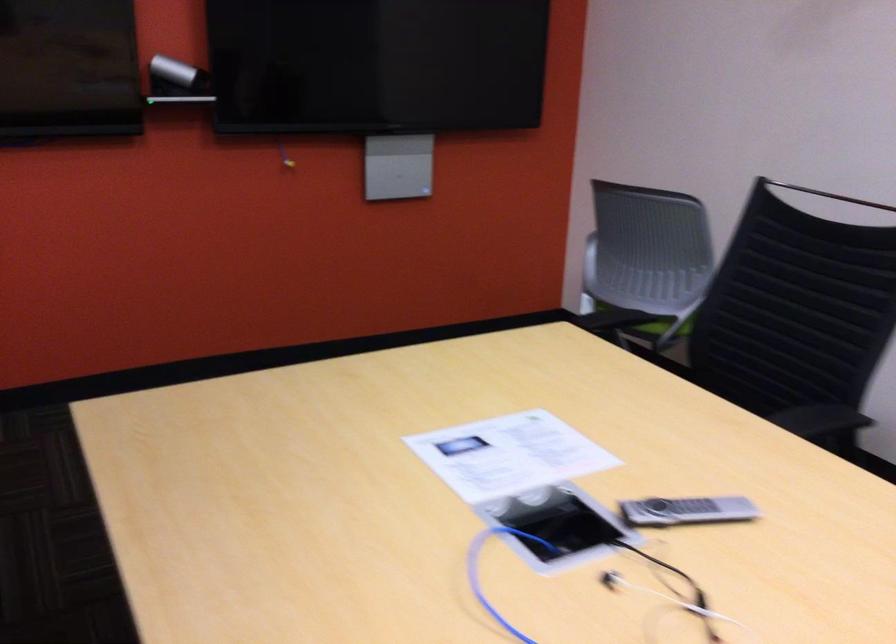
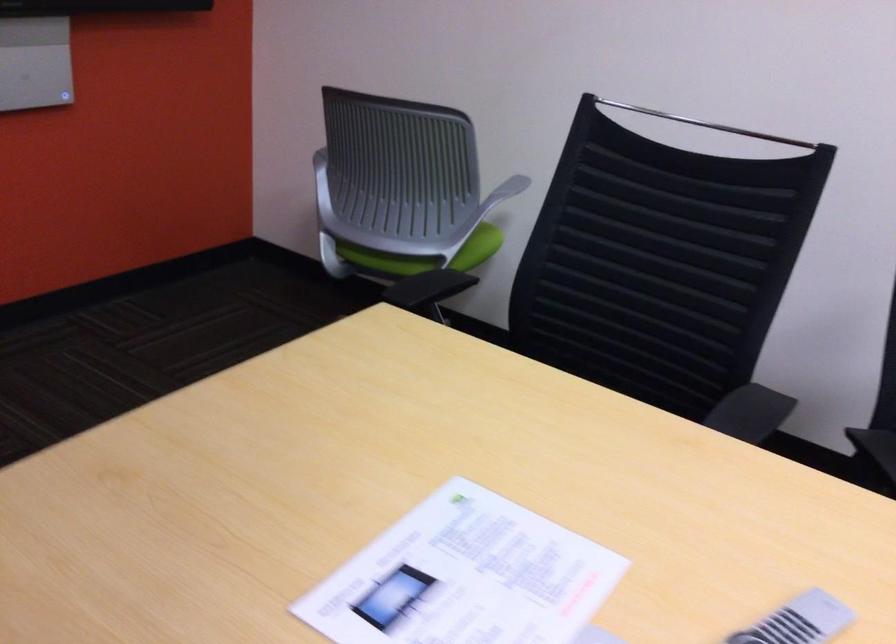
Which direction would the cameraman need to move to produce the second image?

The cameraman moved toward left, forward.